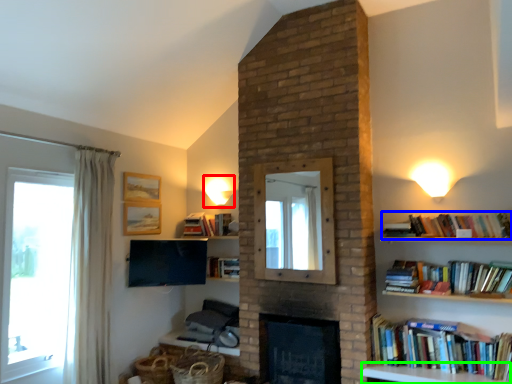
Question: Based on their relative distances, which object is nearer to light fixture (highlighted by a red box)? Choose from book (highlighted by a blue box) and furniture (highlighted by a green box).

Choices:
 (A) book
 (B) furniture

Answer: (A)